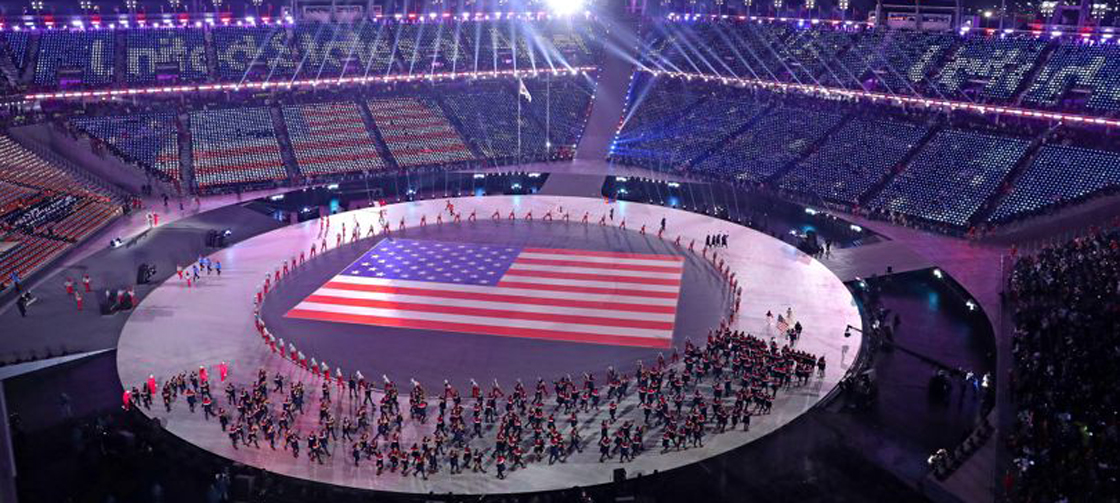
This screenshot has height=503, width=1120. I want to click on main entry ways, so click(x=600, y=115), click(x=93, y=155), click(x=1045, y=230).